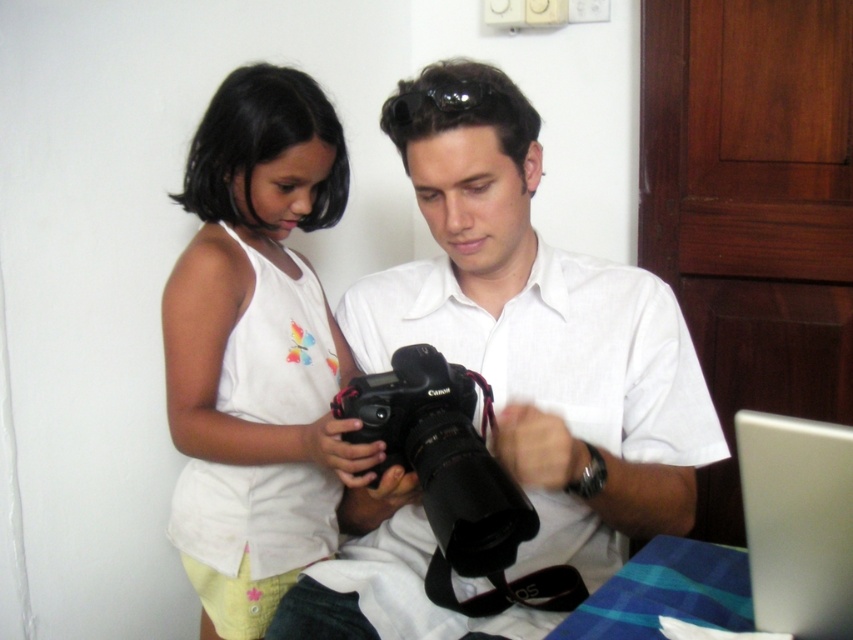
Question: Can you confirm if white cotton tank top at upper left is bigger than white glossy laptop at lower right?

Choices:
 (A) yes
 (B) no

Answer: (A)

Question: Which of the following is the closest to the observer?

Choices:
 (A) white glossy laptop at lower right
 (B) black matte camera at center
 (C) matte black camera at center
 (D) white cotton tank top at upper left

Answer: (A)

Question: Which object is the closest to the white glossy laptop at lower right?

Choices:
 (A) white cotton tank top at upper left
 (B) matte black camera at center
 (C) black matte camera at center

Answer: (C)

Question: Can you confirm if matte black camera at center is smaller than white cotton tank top at upper left?

Choices:
 (A) yes
 (B) no

Answer: (B)

Question: Which point appears closest to the camera in this image?

Choices:
 (A) (196, 268)
 (B) (495, 508)
 (C) (814, 522)

Answer: (C)

Question: Is matte black camera at center positioned in front of white cotton tank top at upper left?

Choices:
 (A) yes
 (B) no

Answer: (B)